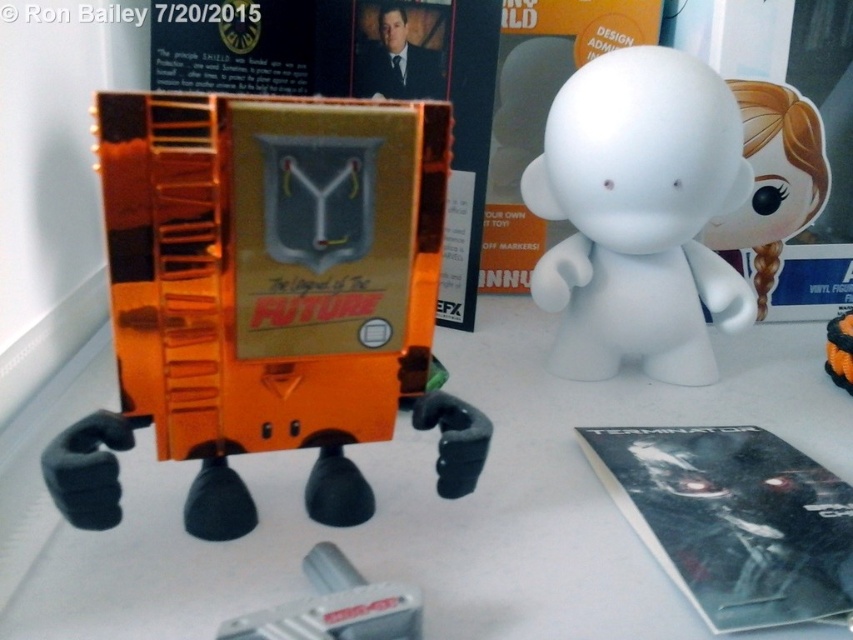
Between translucent orange plastic toy at center and white matte figurine at center, which one is positioned higher?

Positioned higher is white matte figurine at center.

Does point (138, 404) come in front of point (718, 278)?

Yes, point (138, 404) is closer to viewer.

Between point (244, 144) and point (582, 132), which one is positioned behind?

The point (582, 132) is behind.

This screenshot has width=853, height=640. Find the location of `translucent orange plastic toy at center`. translucent orange plastic toy at center is located at coordinates (267, 298).

Is white matte figurine at center below metallic gray tool at lower center?

No.

Which is in front, point (618, 81) or point (328, 616)?

Point (328, 616)

Locate an element on the screen. The image size is (853, 640). white matte figurine at center is located at coordinates [639, 216].

Can you confirm if translucent orange plastic toy at center is positioned below metallic gray tool at lower center?

No, translucent orange plastic toy at center is not below metallic gray tool at lower center.

Who is shorter, translucent orange plastic toy at center or metallic gray tool at lower center?

Standing shorter between the two is metallic gray tool at lower center.

Does point (450, 492) lie in front of point (352, 568)?

No, it is behind (352, 568).

Locate an element on the screen. translucent orange plastic toy at center is located at coordinates (267, 298).